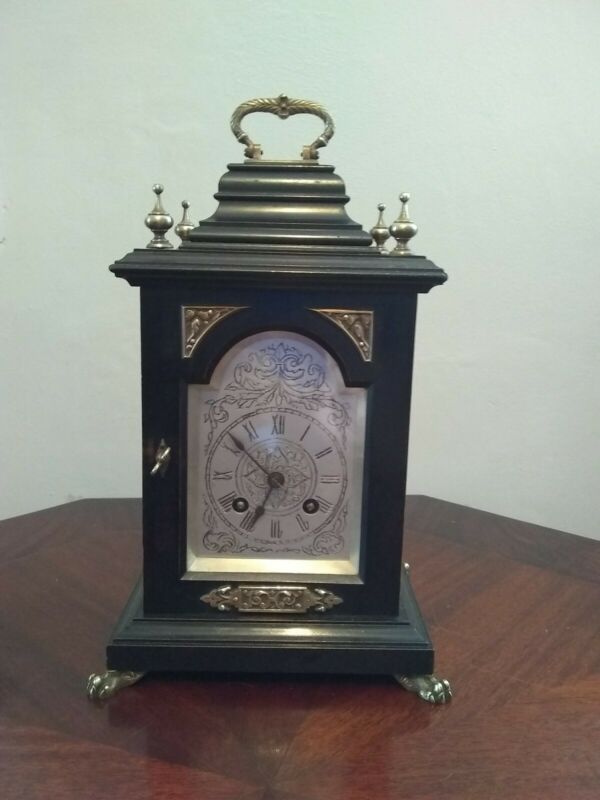
At what (x,y) coordinates should I click in order to perform the action: click on empty white wall above clock. Please return your answer as a coordinate pair (x, y). This screenshot has height=800, width=600. Looking at the image, I should click on (281, 38).